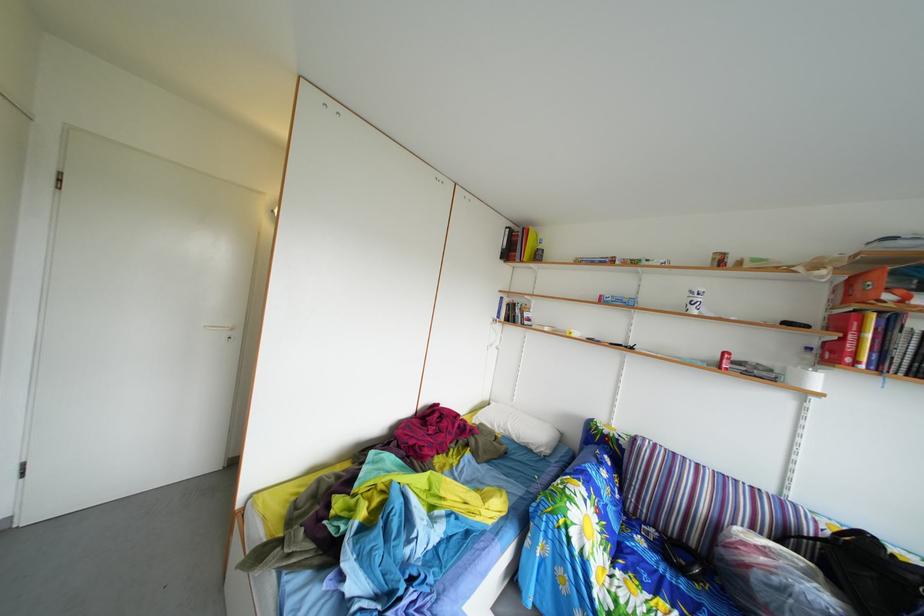
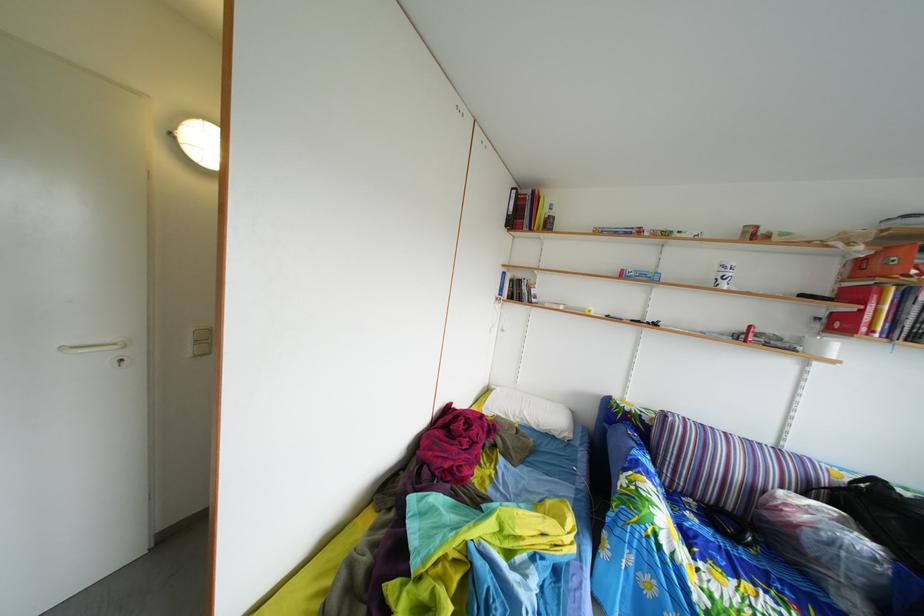
Question: The images are taken continuously from a first-person perspective. In which direction is your viewpoint rotating?

Choices:
 (A) Left
 (B) Right
 (C) Up
 (D) Down

Answer: (B)